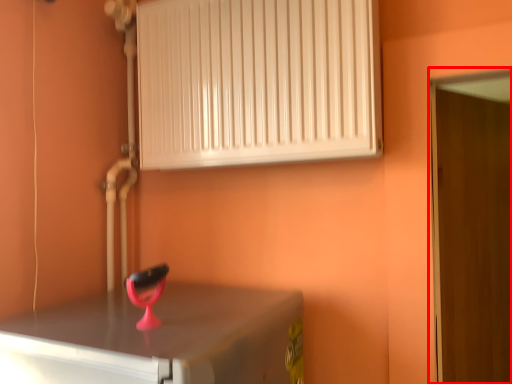
Question: From the image's perspective, where is door (annotated by the red box) located in relation to radiator in the image?

Choices:
 (A) below
 (B) above

Answer: (A)